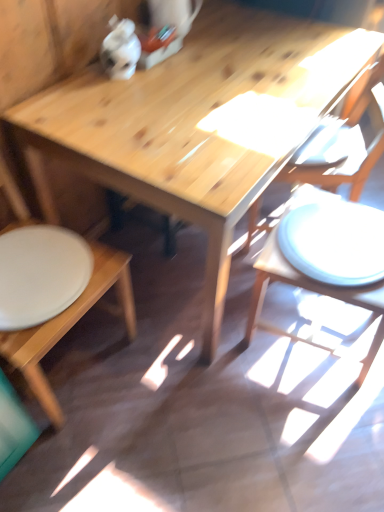
Identify the location of vacant region to the right of wooden chair at lower left, which is the 2th chair from right to left. Image resolution: width=384 pixels, height=512 pixels. (159, 393).